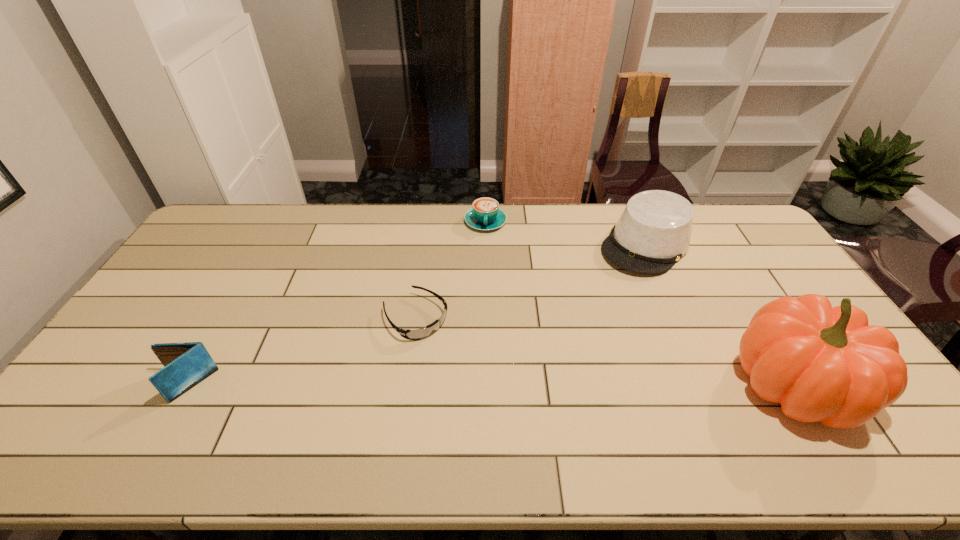
Image resolution: width=960 pixels, height=540 pixels. I want to click on vacant space on the desktop that is between the leftmost object and the pumpkin and is positioned on the lenses of the sunglasses, so click(x=490, y=385).

Where is `vacant space on the desktop that is between the third tallest object and the tallest object and is positioned on the front-facing side of the hat`? Image resolution: width=960 pixels, height=540 pixels. vacant space on the desktop that is between the third tallest object and the tallest object and is positioned on the front-facing side of the hat is located at coordinates point(516,385).

Identify the location of free spot on the desktop that is between the third shortest object and the pumpkin and is positioned with the handle on the right side of the cappuccino. (484, 385).